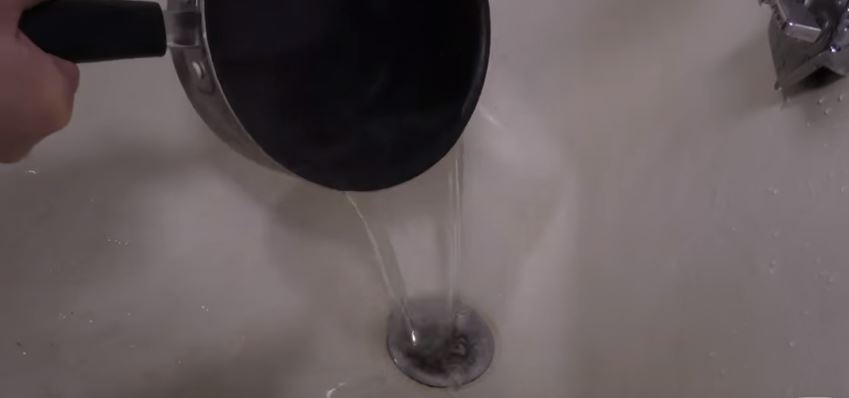
Locate an element on the screen. light reflections is located at coordinates (413, 340), (330, 392), (490, 117).